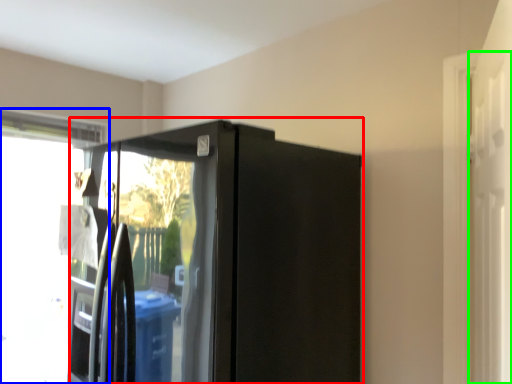
Question: Estimate the real-world distances between objects in this image. Which object is closer to appliance (highlighted by a red box), window (highlighted by a blue box) or screen door (highlighted by a green box)?

Choices:
 (A) window
 (B) screen door

Answer: (B)